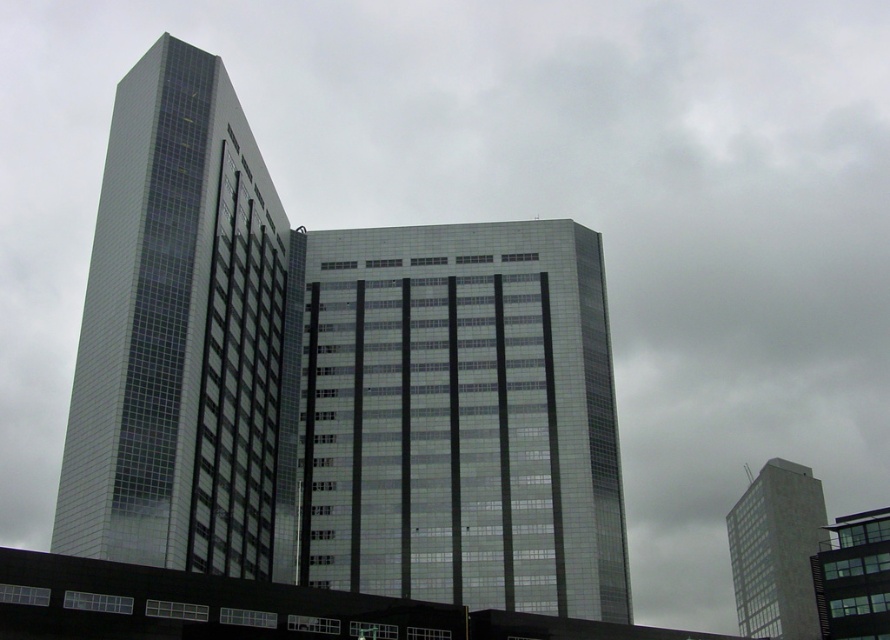
Is point (573, 269) positioned after point (747, 577)?

No, (573, 269) is in front of (747, 577).

Who is lower down, glassy reflective building at center or smooth concrete tower at right?

smooth concrete tower at right is lower down.

Is point (338, 348) positioned behind point (775, 636)?

That is False.

Find the location of `glassy reflective building at center`. glassy reflective building at center is located at coordinates (460, 419).

Who is more forward, (439, 506) or (874, 589)?

Point (439, 506)

Between glassy reflective building at center and glassy reflective building at lower right, which one has more height?

glassy reflective building at lower right

Identify the location of glassy reflective building at center. This screenshot has height=640, width=890. (460, 419).

Where is `glassy reflective building at center`? Image resolution: width=890 pixels, height=640 pixels. glassy reflective building at center is located at coordinates (460, 419).

Does point (249, 212) come behind point (751, 529)?

No, (249, 212) is closer to viewer.

Which is more to the left, glassy reflective tower at left or smooth concrete tower at right?

Positioned to the left is glassy reflective tower at left.

This screenshot has width=890, height=640. Describe the element at coordinates (183, 339) in the screenshot. I see `glassy reflective tower at left` at that location.

The width and height of the screenshot is (890, 640). I want to click on glassy reflective tower at left, so click(183, 339).